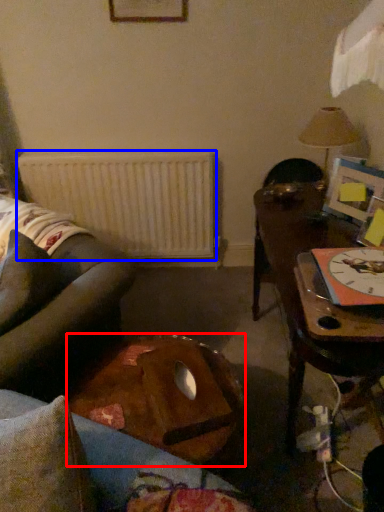
Question: Which point is closer to the camera, table (highlighted by a red box) or radiator (highlighted by a blue box)?

Choices:
 (A) table
 (B) radiator

Answer: (A)